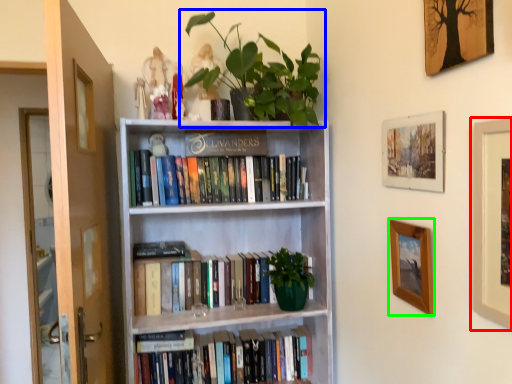
Question: Which is farther away from picture frame (highlighted by a red box)? houseplant (highlighted by a blue box) or picture frame (highlighted by a green box)?

Choices:
 (A) houseplant
 (B) picture frame

Answer: (A)